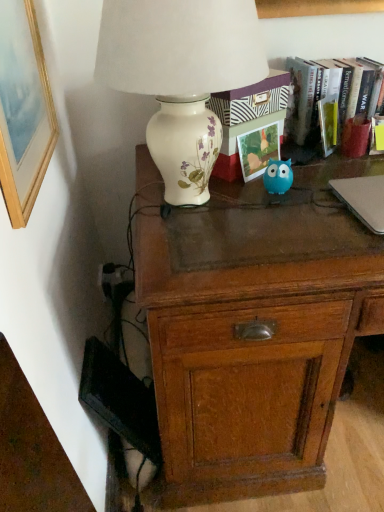
Where is `vacant area to the left of silver metallic laptop at right`? vacant area to the left of silver metallic laptop at right is located at coordinates (300, 221).